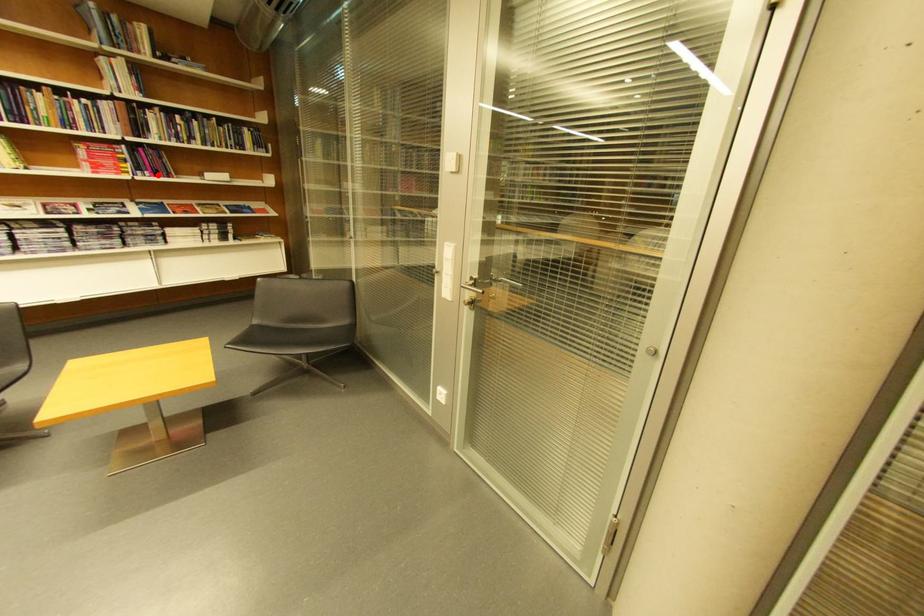
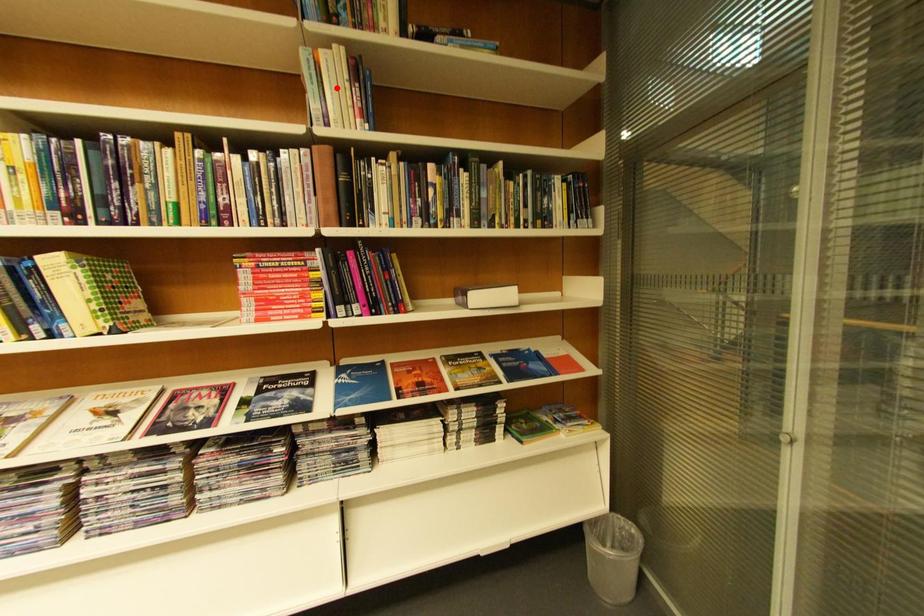
I am providing you with two images of the same scene from different viewpoints. A red point is marked on the first image and another point is marked on the second image. Are the points marked in image1 and image2 representing the same 3D position?

No